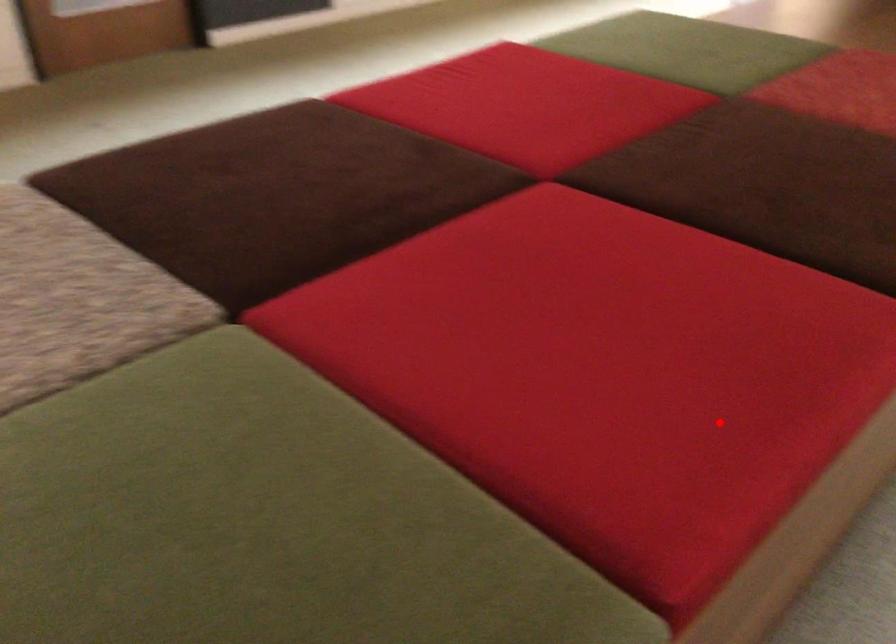
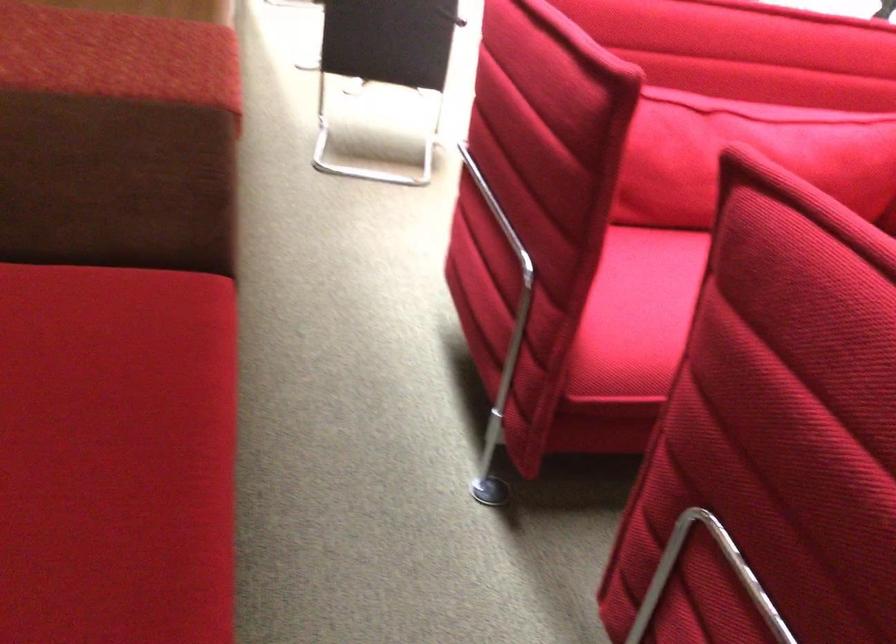
Question: A red point is marked in image1. In image2, is the corresponding 3D point closer to the camera or farther? Reply with the corresponding letter.

Choices:
 (A) The corresponding 3D point is closer.
 (B) The corresponding 3D point is farther.

Answer: (A)